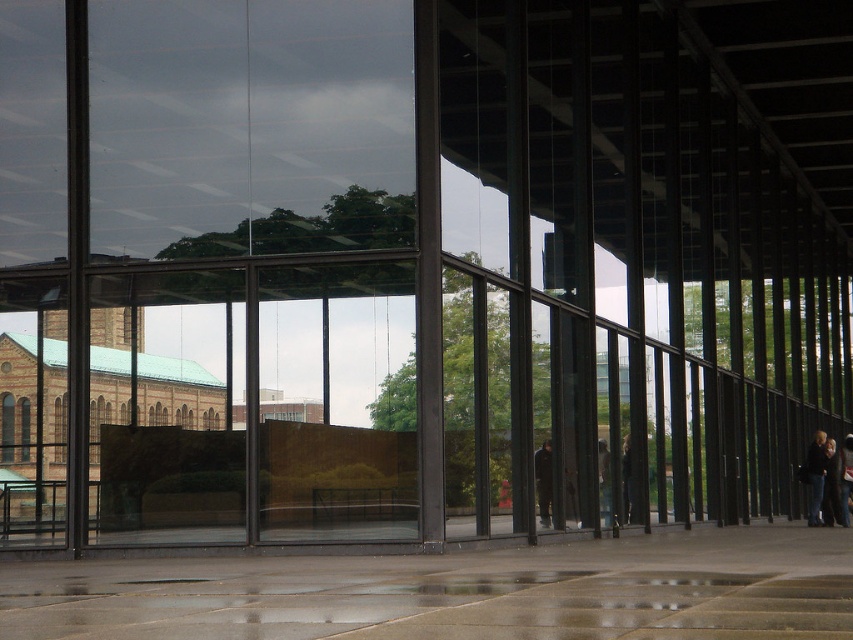
This screenshot has width=853, height=640. Describe the element at coordinates (830, 486) in the screenshot. I see `dark gray jacket at lower right` at that location.

Can you confirm if dark gray jacket at lower right is positioned to the right of dark blue jeans at right?

No, dark gray jacket at lower right is not to the right of dark blue jeans at right.

What are the coordinates of `dark gray jacket at lower right` in the screenshot? It's located at (830, 486).

Who is shorter, transparent glass door at center or dark blue jeans at right?

dark blue jeans at right

Who is more distant from viewer, (364, 420) or (840, 492)?

Positioned behind is point (840, 492).

Locate an element on the screen. The image size is (853, 640). transparent glass door at center is located at coordinates (271, 410).

Between dark gray fabric jacket at center and dark blue jeans at right, which one appears on the right side from the viewer's perspective?

From the viewer's perspective, dark blue jeans at right appears more on the right side.

Who is taller, dark gray fabric jacket at center or dark blue jeans at right?

With more height is dark blue jeans at right.

Locate an element on the screen. The image size is (853, 640). dark gray fabric jacket at center is located at coordinates (543, 481).